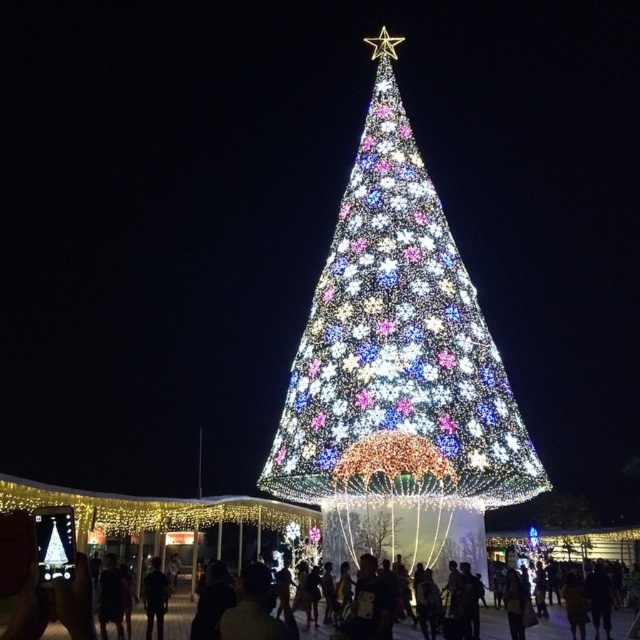
You are standing in front of the Christmas tree scene. You notice the illuminated plastic christmas tree at center and the dark hair at lower center. Which object is positioned higher in the image?

The illuminated plastic christmas tree at center is located above dark hair at lower center, so it is positioned higher.

You are a photographer trying to capture the illuminated plastic christmas tree at center and the dark hair at lower center in the same frame. Which object will appear narrower in the photo?

The illuminated plastic christmas tree at center will appear narrower in the photo because it is thinner than the dark hair at lower center.

You are a photographer trying to capture a photo of the illuminated plastic christmas tree at center and dark hair at lower center. Since you want both subjects to be in focus, which one should you focus on first to ensure proper depth of field?

The illuminated plastic christmas tree at center is much taller than the dark hair at lower center, so you should focus on the illuminated plastic christmas tree at center first to ensure proper depth of field.